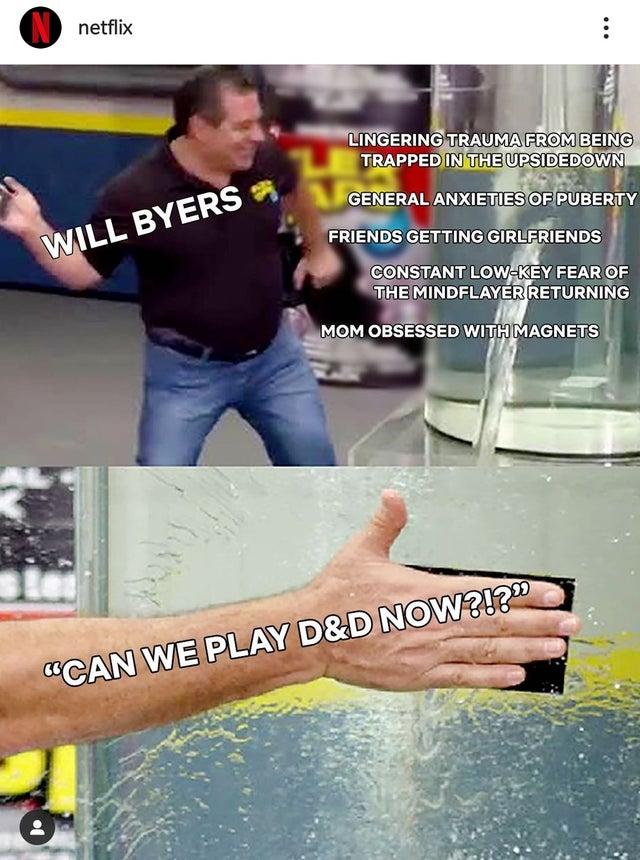
The height and width of the screenshot is (860, 640). Identify the location of wall. (66, 149), (47, 539).